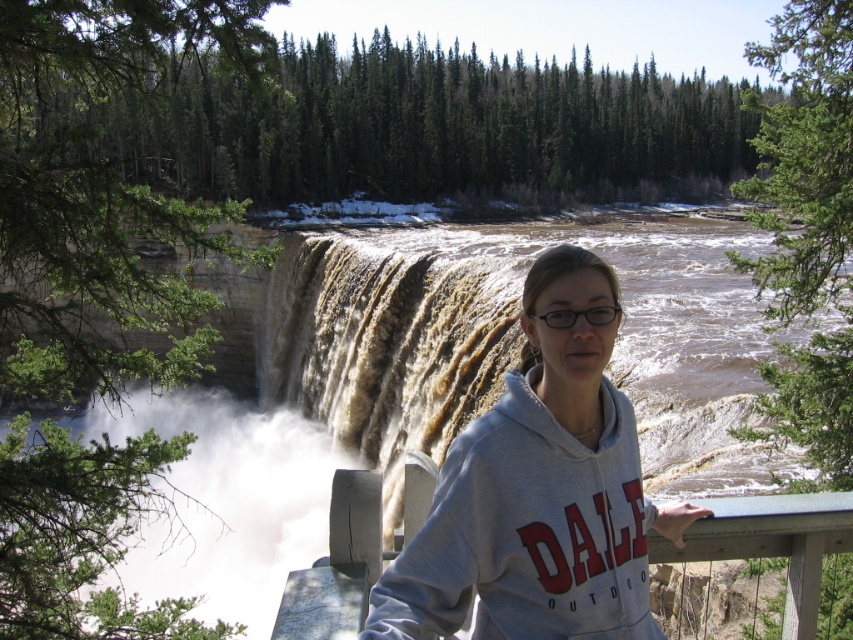
Does brown textured water at center appear over gray fleece sweatshirt at center?

Indeed, brown textured water at center is positioned over gray fleece sweatshirt at center.

From the picture: Between brown textured water at center and gray fleece sweatshirt at center, which one is positioned higher?

brown textured water at center is above.

Find the location of a particular element. brown textured water at center is located at coordinates (434, 385).